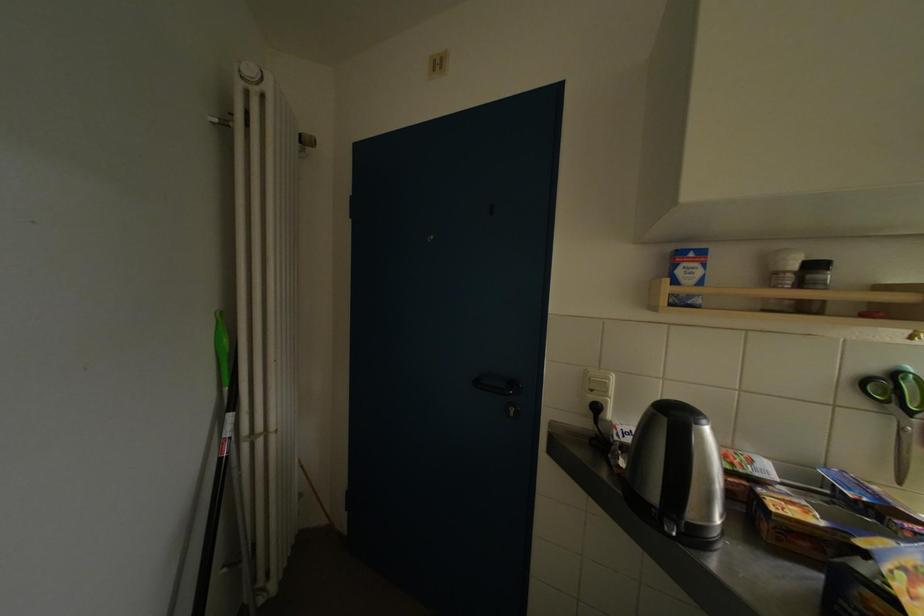
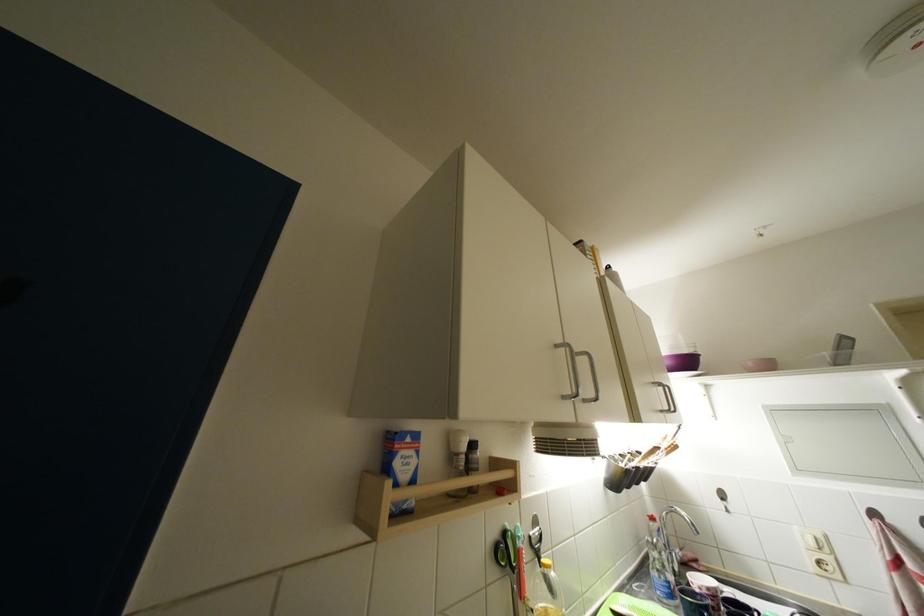
Find the pixel in the second image that matches the point at 784,277 in the first image.

(464, 458)